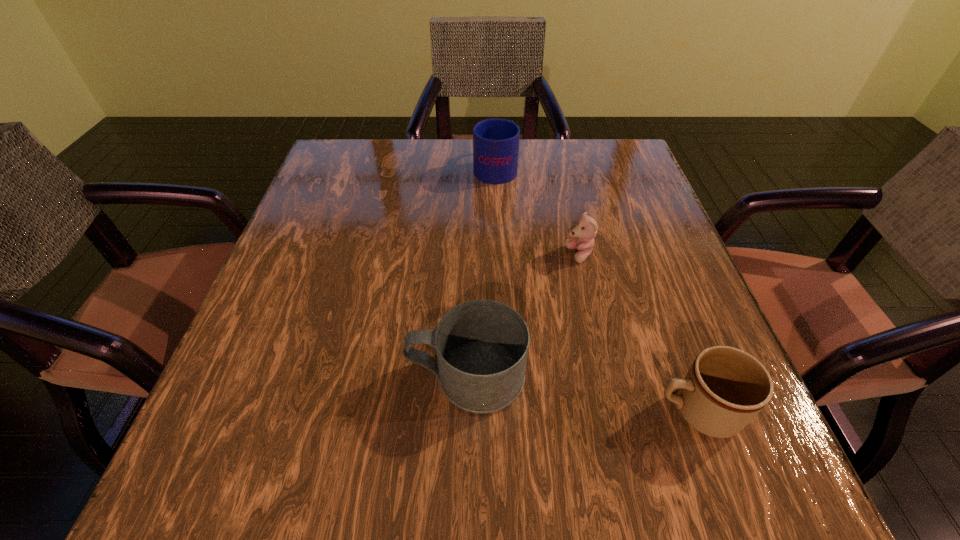
Find the location of a particular element. This screenshot has height=540, width=960. vacant space that satisfies the following two spatial constraints: 1. on the side of the rightmost mug with the handle; 2. at the face of the second farthest object is located at coordinates (639, 255).

Where is `vacant space that satisfies the following two spatial constraints: 1. on the side of the rightmost mug with the handle; 2. at the face of the third nearest object`? Image resolution: width=960 pixels, height=540 pixels. vacant space that satisfies the following two spatial constraints: 1. on the side of the rightmost mug with the handle; 2. at the face of the third nearest object is located at coordinates (639, 255).

Locate an element on the screen. vacant region that satisfies the following two spatial constraints: 1. on the side of the rightmost mug with the handle; 2. at the face of the second farthest object is located at coordinates (639, 255).

The height and width of the screenshot is (540, 960). In order to click on free space that satisfies the following two spatial constraints: 1. on the side of the rightmost object with the handle; 2. at the face of the third object from left to right in this screenshot , I will do coord(639,255).